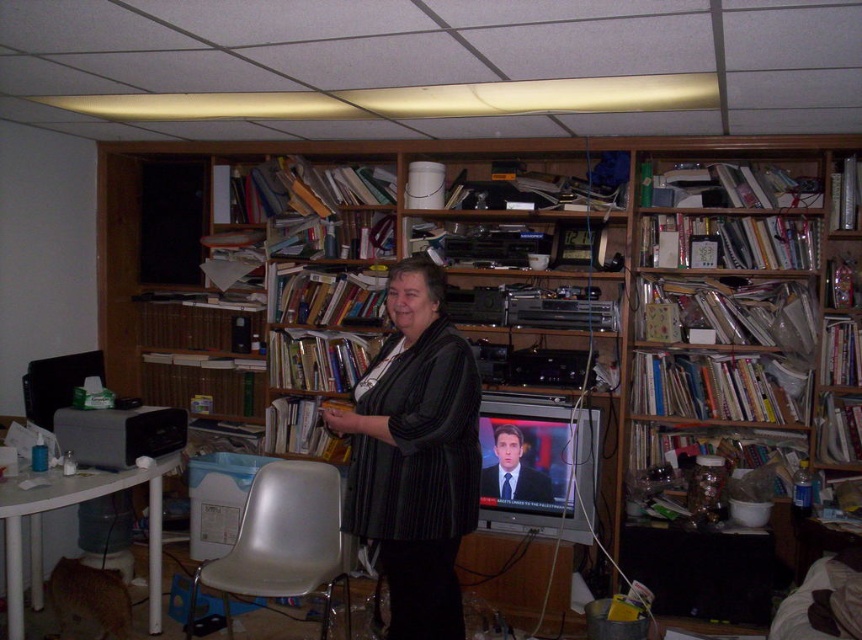
Question: Which of the following is the closest to the observer?

Choices:
 (A) blue suit at center
 (B) white plastic chair at lower center

Answer: (B)

Question: Which point is farther from the camera taking this photo?

Choices:
 (A) (436, 614)
 (B) (542, 499)

Answer: (B)

Question: Can you confirm if white plastic chair at lower center is positioned to the left of blue suit at center?

Choices:
 (A) yes
 (B) no

Answer: (A)

Question: Considering the relative positions of white plastic chair at lower center and blue suit at center in the image provided, where is white plastic chair at lower center located with respect to blue suit at center?

Choices:
 (A) left
 (B) right

Answer: (A)

Question: Can you confirm if black textured sweater at center is smaller than blue suit at center?

Choices:
 (A) yes
 (B) no

Answer: (B)

Question: Based on their relative distances, which object is nearer to the white plastic chair at lower center?

Choices:
 (A) blue suit at center
 (B) black textured sweater at center

Answer: (B)